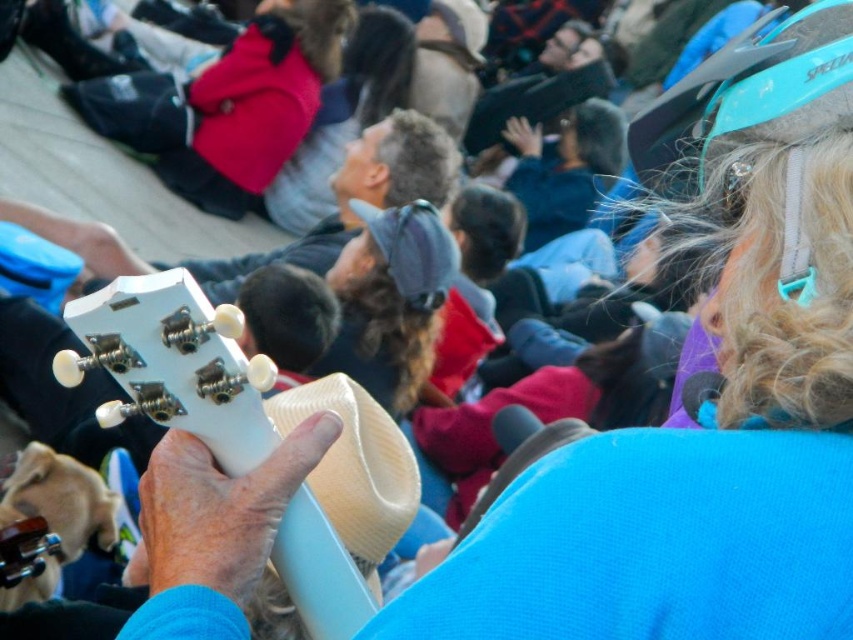
You are a photographer at the event and want to capture both the matte white ukulele at center and the beige woven cowboy hat at center in a single shot. Which object should you position closer to the left side of your camera frame?

The matte white ukulele at center is to the left of the beige woven cowboy hat at center, so you should position the matte white ukulele at center closer to the left side of your camera frame.

You are a photographer at the event and want to capture a photo that includes both the matte white ukulele at center and the blue fabric jacket at center. Based on their positions, which object should you place on the left side of the photo to ensure both are in frame?

The matte white ukulele at center should be placed on the left side of the photo because it is already positioned to the left of the blue fabric jacket at center, allowing both to be included in the frame.